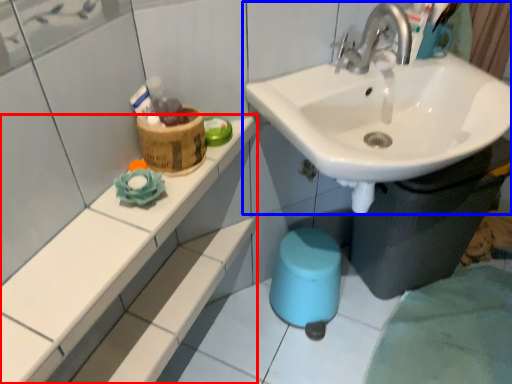
Question: Which object appears closest to the camera in this image, counter top (highlighted by a red box) or sink (highlighted by a blue box)?

Choices:
 (A) counter top
 (B) sink

Answer: (A)